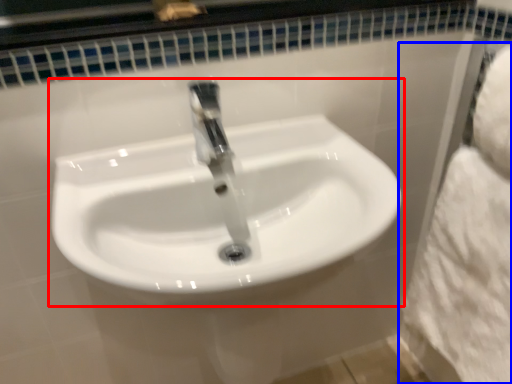
Question: Which of the following is the farthest to the observer, sink (highlighted by a red box) or bath towel (highlighted by a blue box)?

Choices:
 (A) sink
 (B) bath towel

Answer: (B)